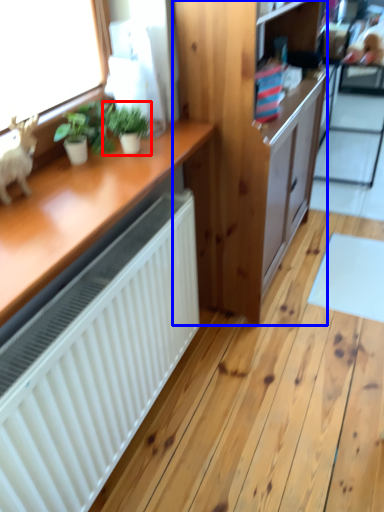
Question: Which point is closer to the camera, houseplant (highlighted by a red box) or cabinetry (highlighted by a blue box)?

Choices:
 (A) houseplant
 (B) cabinetry

Answer: (A)